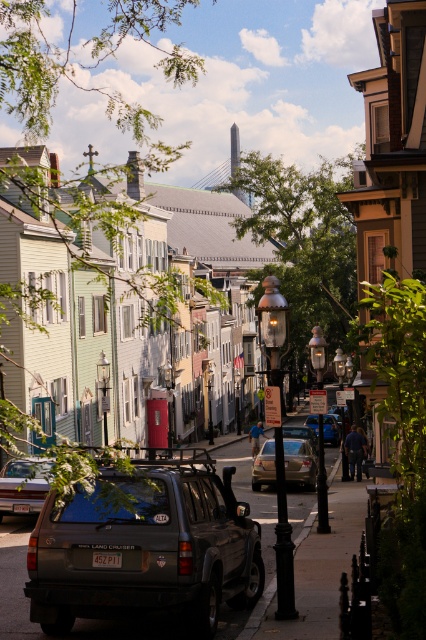
Question: Among these objects, which one is farthest from the camera?

Choices:
 (A) matte gray suv at lower left
 (B) metallic silver sedan at center
 (C) satin gold sedan at center

Answer: (B)

Question: Can you confirm if matte gray suv at lower left is positioned to the right of metallic silver suv at center?

Choices:
 (A) no
 (B) yes

Answer: (A)

Question: Which is nearer to the metallic silver sedan at center?

Choices:
 (A) matte gray suv at center
 (B) satin gold sedan at center
 (C) matte gray suv at lower left
 (D) metallic silver suv at center

Answer: (D)

Question: Can you confirm if satin gold sedan at center is positioned below metallic silver sedan at center?

Choices:
 (A) yes
 (B) no

Answer: (B)

Question: Can you confirm if satin gold sedan at center is wider than metallic silver sedan at center?

Choices:
 (A) no
 (B) yes

Answer: (A)

Question: Which of the following is the farthest from the observer?

Choices:
 (A) matte gray suv at center
 (B) metallic silver sedan at center
 (C) satin gold sedan at center
 (D) metallic silver suv at center

Answer: (D)